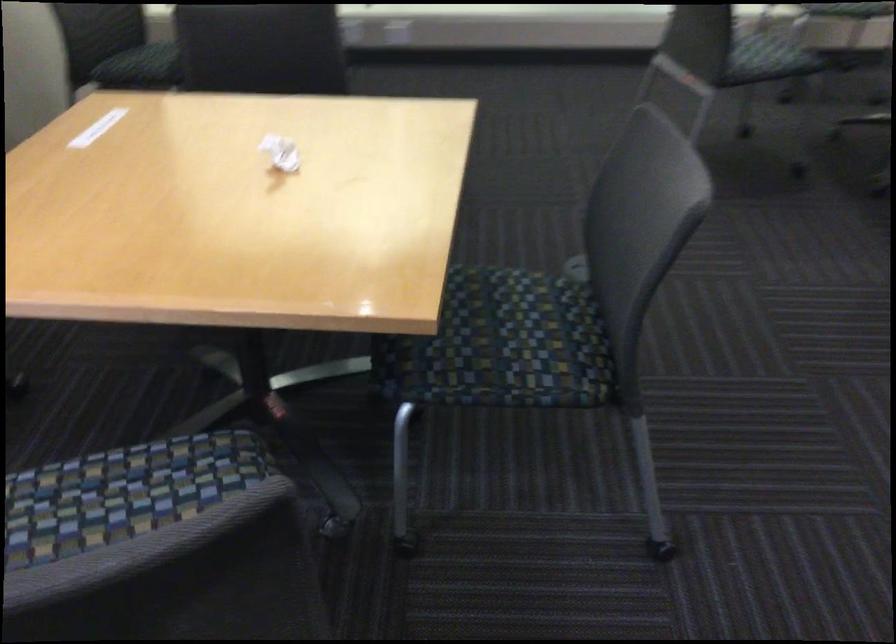
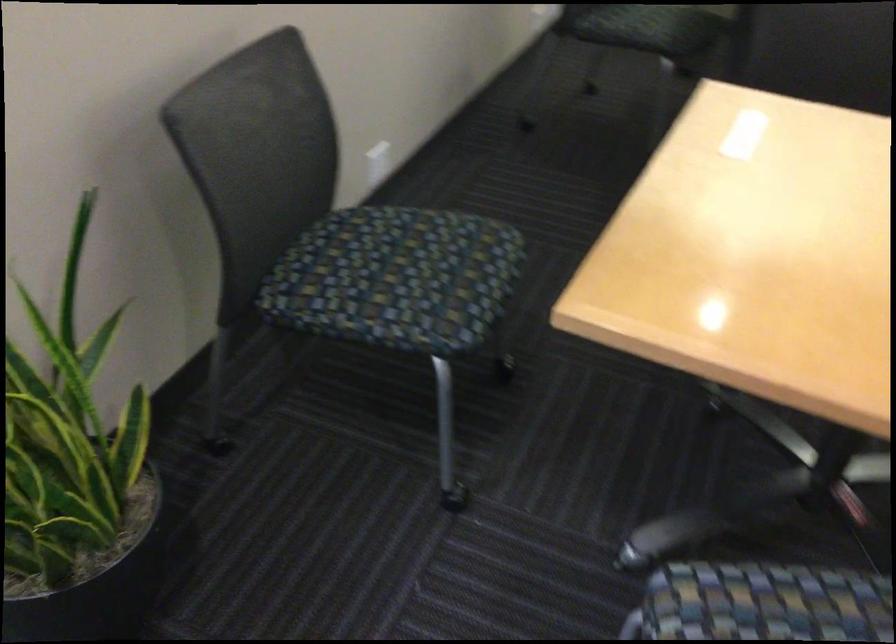
In the second image, find the point that corresponds to the point at 96,491 in the first image.

(765, 603)